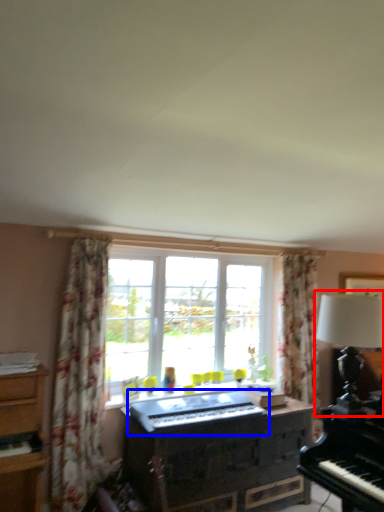
Question: Which point is further to the camera, table lamp (highlighted by a red box) or musical keyboard (highlighted by a blue box)?

Choices:
 (A) table lamp
 (B) musical keyboard

Answer: (B)